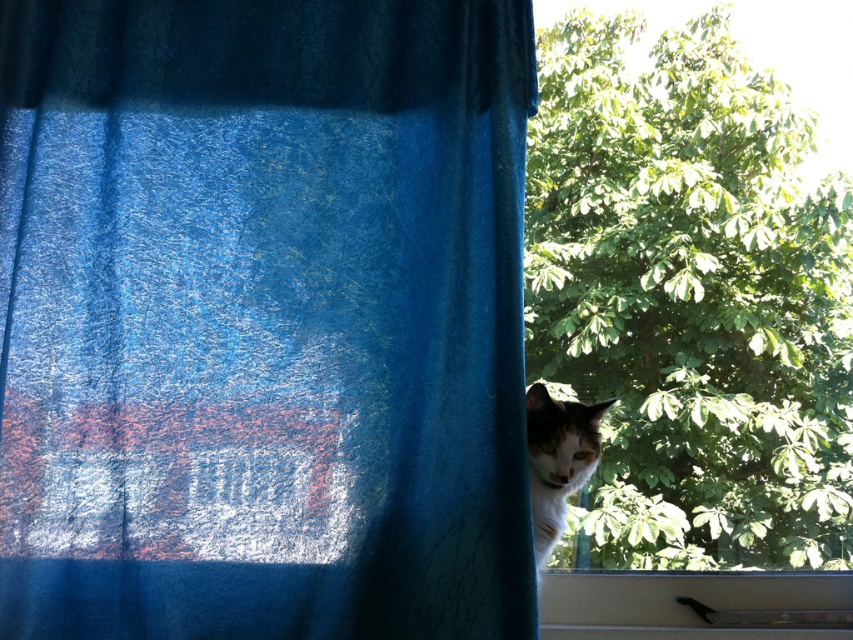
Is blue velvet curtain at center wider than white plastic window sill at lower right?

Indeed, blue velvet curtain at center has a greater width compared to white plastic window sill at lower right.

Locate an element on the screen. The width and height of the screenshot is (853, 640). blue velvet curtain at center is located at coordinates (263, 320).

Is blue velvet curtain at center to the left of white fur cat at window right from the viewer's perspective?

Correct, you'll find blue velvet curtain at center to the left of white fur cat at window right.

Looking at this image, which is more to the right, blue velvet curtain at center or white fur cat at window right?

Positioned to the right is white fur cat at window right.

The height and width of the screenshot is (640, 853). What are the coordinates of `blue velvet curtain at center` in the screenshot? It's located at (263, 320).

At what (x,y) coordinates should I click in order to perform the action: click on blue velvet curtain at center. Please return your answer as a coordinate pair (x, y). Image resolution: width=853 pixels, height=640 pixels. Looking at the image, I should click on (263, 320).

Does blue velvet curtain at center come behind transparent glass window at center?

That is False.

Between blue velvet curtain at center and transparent glass window at center, which one appears on the right side from the viewer's perspective?

From the viewer's perspective, transparent glass window at center appears more on the right side.

Does point (99, 186) come in front of point (846, 480)?

Yes, it is in front of point (846, 480).

At what (x,y) coordinates should I click in order to perform the action: click on blue velvet curtain at center. Please return your answer as a coordinate pair (x, y). Looking at the image, I should click on (263, 320).